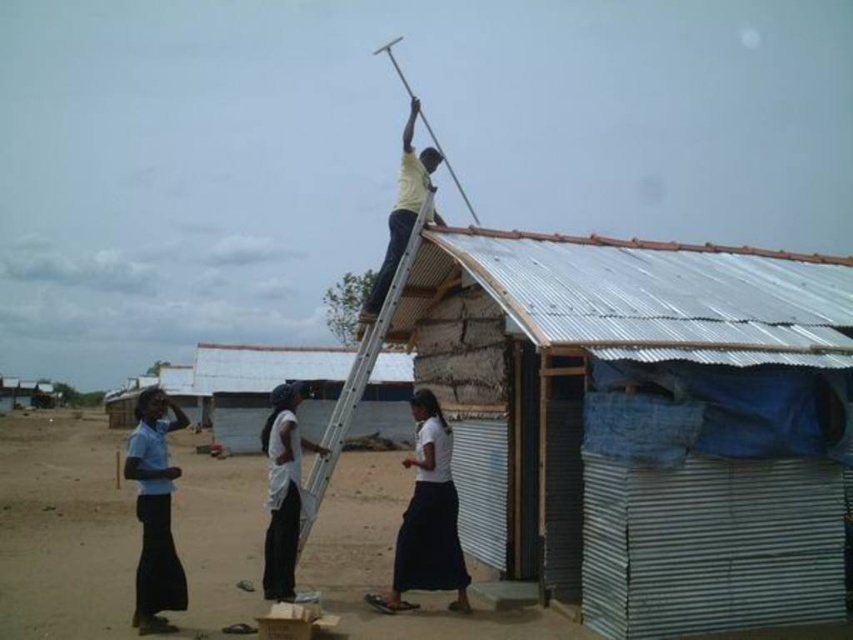
You are a construction worker who needs to place a 15 meter long safety rope between the blue fabric skirt at lower left and the white corrugated metal roof at upper center. Can you safely secure the rope between these two points without it being too short?

The distance between the blue fabric skirt at lower left and the white corrugated metal roof at upper center is 16.76 meters. Since the safety rope is only 15 meters long, it would be too short to securely span the distance between them. A longer rope is needed for this setup.

You are a worker trying to reach the roof of the metal corrugated hut at upper right. You see the metallic silver ladder at upper center. Is the ladder positioned in a way that you can climb it to reach the roof?

The metal corrugated hut at upper right is located below the metallic silver ladder at upper center, so the ladder is positioned above the hut. Therefore, climbing the metallic silver ladder at upper center would allow you to reach the roof of the metal corrugated hut at upper right.